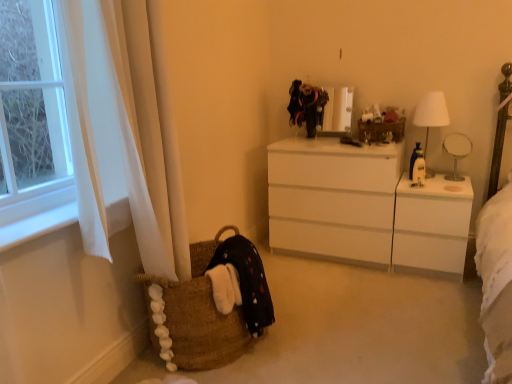
Where is `free space in front of white glossy changing table at right`? This screenshot has height=384, width=512. free space in front of white glossy changing table at right is located at coordinates (435, 296).